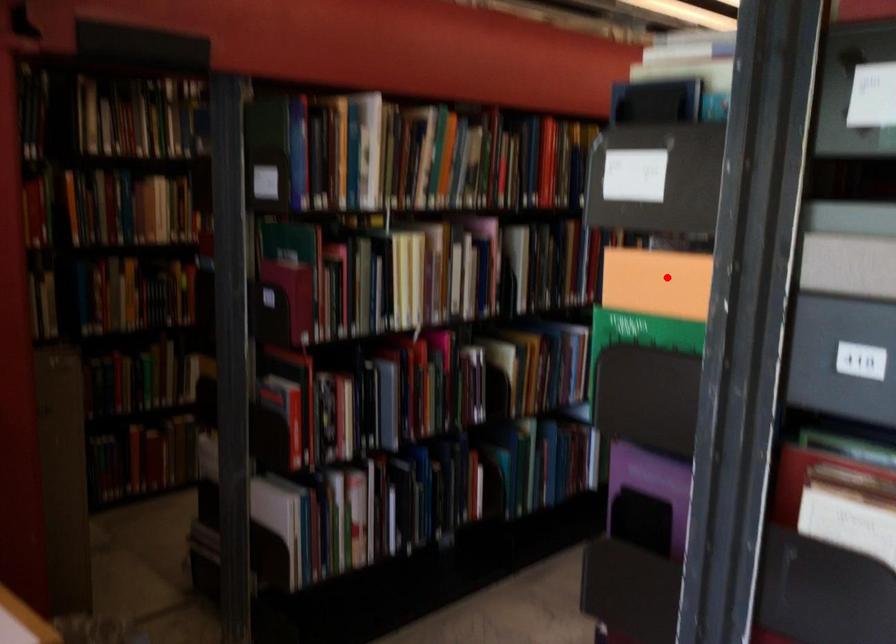
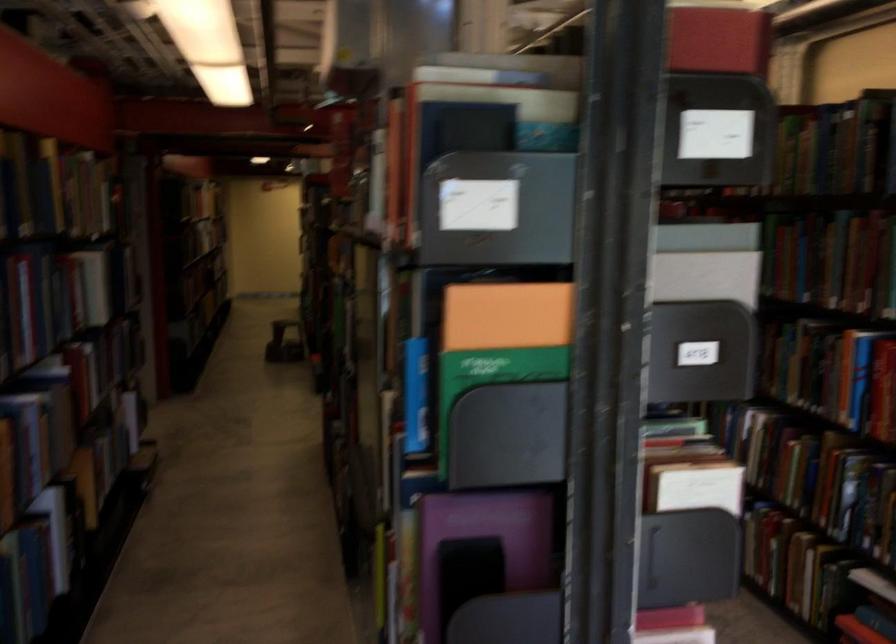
Find the pixel in the second image that matches the highlighted location in the first image.

(506, 315)